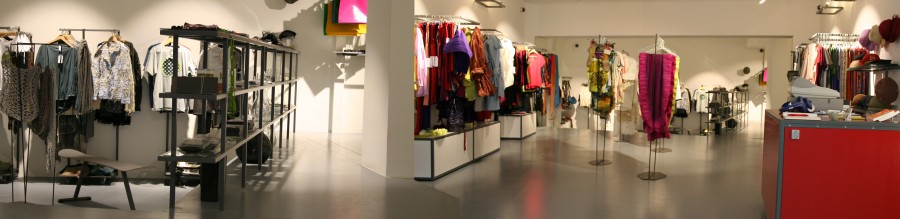
Image resolution: width=900 pixels, height=219 pixels. Identify the location of bench. (411, 217), (122, 170).